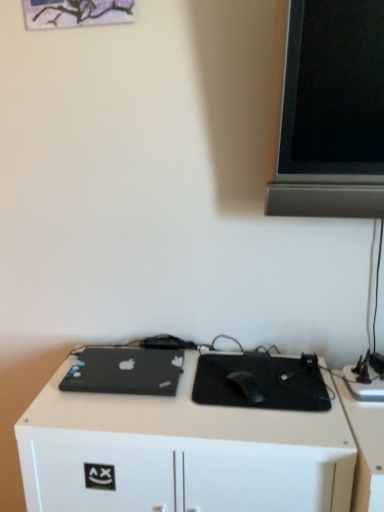
Locate an element on the screen. The image size is (384, 512). vacant space that's between black matte laptop at lower left and black matte mousepad at center is located at coordinates (182, 384).